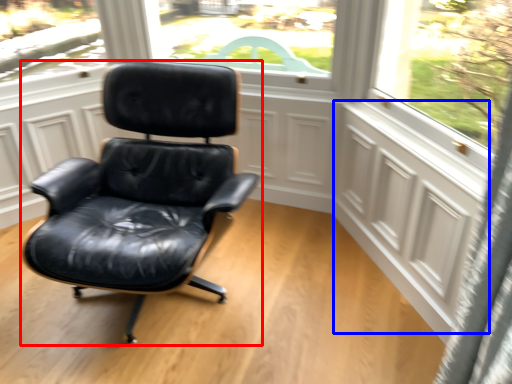
Question: Which of the following is the closest to the observer, chair (highlighted by a red box) or screen door (highlighted by a blue box)?

Choices:
 (A) chair
 (B) screen door

Answer: (A)